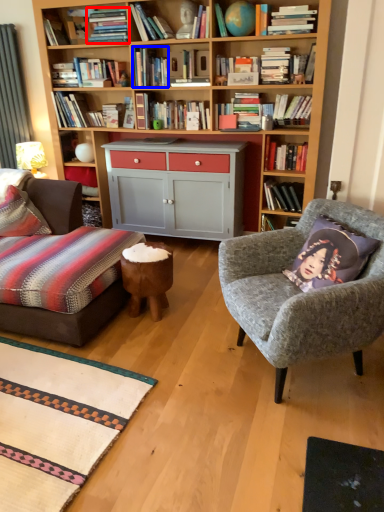
Question: Which object appears closest to the camera in this image, book (highlighted by a red box) or book (highlighted by a blue box)?

Choices:
 (A) book
 (B) book

Answer: (A)